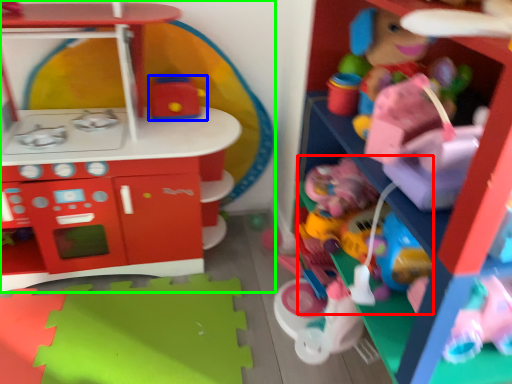
Question: Which object is positioned closest to toy (highlighted by a red box)? Select from toy (highlighted by a blue box) and toy (highlighted by a green box).

Choices:
 (A) toy
 (B) toy

Answer: (A)